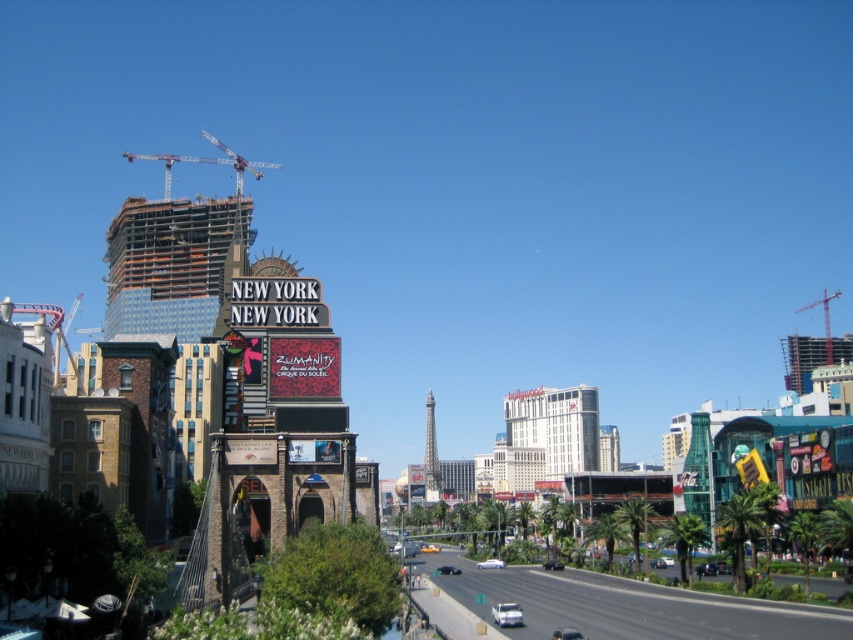
Question: Which point appears farthest from the camera in this image?

Choices:
 (A) (451, 557)
 (B) (189, 160)

Answer: (B)

Question: Estimate the real-world distances between objects in this image. Which object is closer to the metallic construction crane at upper left?

Choices:
 (A) concrete construction site at lower center
 (B) metallic red crane at upper right

Answer: (A)

Question: Is concrete construction site at lower center to the right of metallic red crane at upper right from the viewer's perspective?

Choices:
 (A) no
 (B) yes

Answer: (A)

Question: Can you confirm if concrete construction site at lower center is positioned above metallic red crane at upper right?

Choices:
 (A) yes
 (B) no

Answer: (B)

Question: Which point is closer to the camera?

Choices:
 (A) metallic construction crane at upper left
 (B) metallic red crane at upper right

Answer: (A)

Question: Considering the relative positions of concrete construction site at lower center and metallic red crane at upper right in the image provided, where is concrete construction site at lower center located with respect to metallic red crane at upper right?

Choices:
 (A) below
 (B) above

Answer: (A)